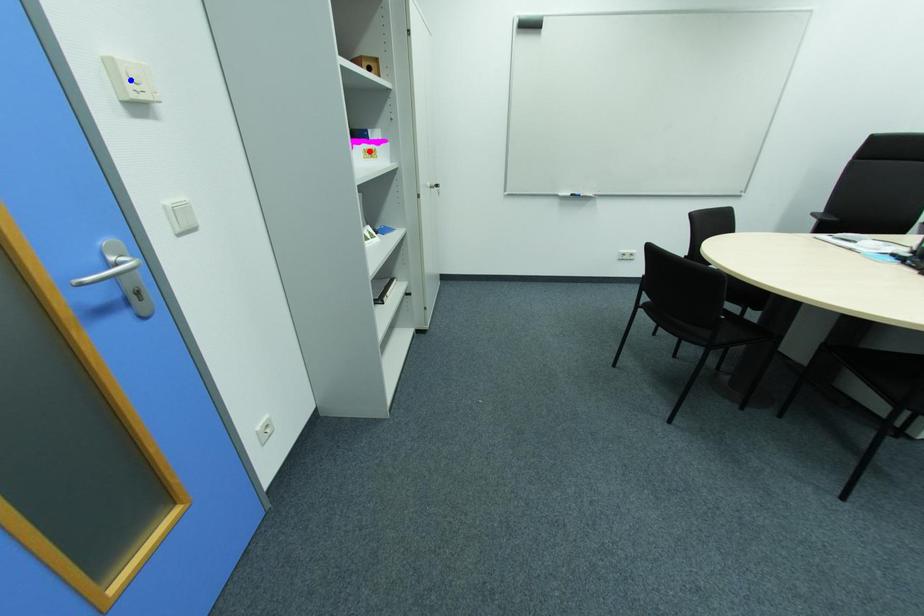
Question: Which of the two points in the image is closer to the camera?

Choices:
 (A) Blue point is closer.
 (B) Red point is closer.

Answer: (A)